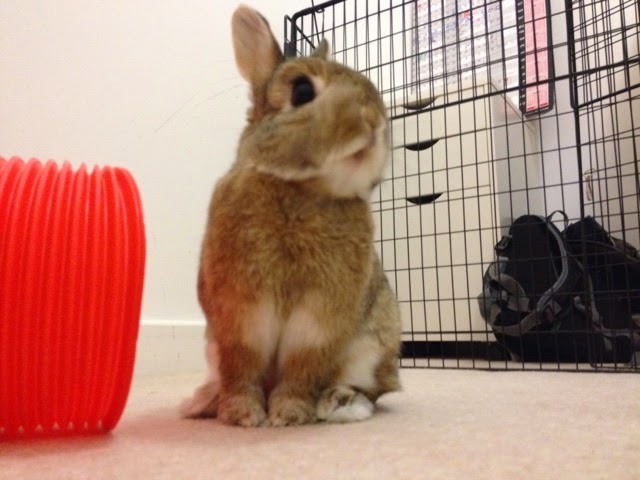
Locate an element on the screen. The image size is (640, 480). cabinet is located at coordinates (461, 116).